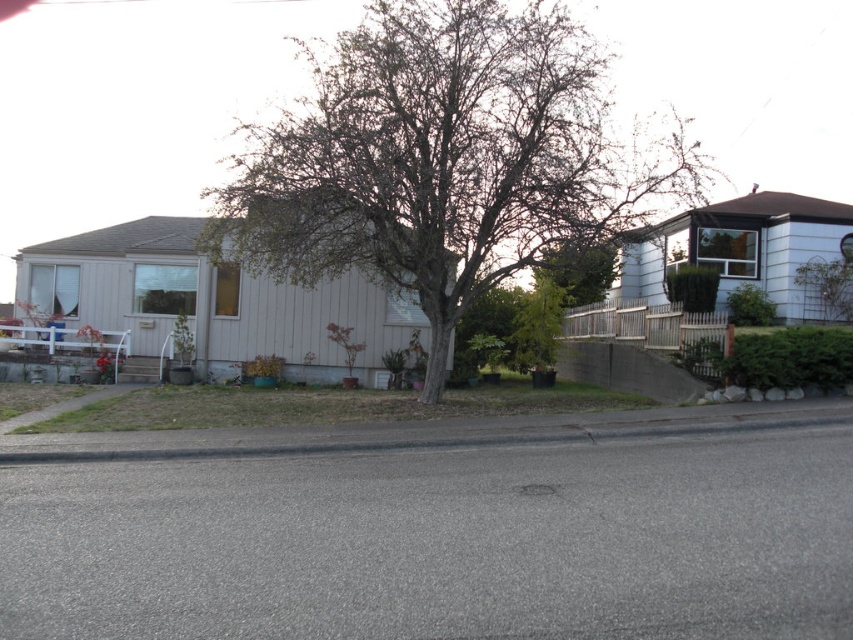
Looking at this image, you are a gardener planning to plant a new tree in the front yard of the house on the left. The front yard has limited space. Based on the image, which tree between the bare wood tree at center and the green leafy tree at center would you recommend planting to ensure it fits better in the space?

The bare wood tree at center might be wider than the green leafy tree at center, so it might not fit better in the limited space of the front yard. The green leafy tree at center could be a better choice as it might be narrower.

You are a delivery person trying to navigate through this street. You see a bare wood tree at center and a green leafy tree at center. Which tree should you avoid hitting your delivery van if you need to drive under them?

The bare wood tree at center has a greater height compared to the green leafy tree at center, so you should avoid hitting the bare wood tree at center as it is taller and poses a higher risk of collision.